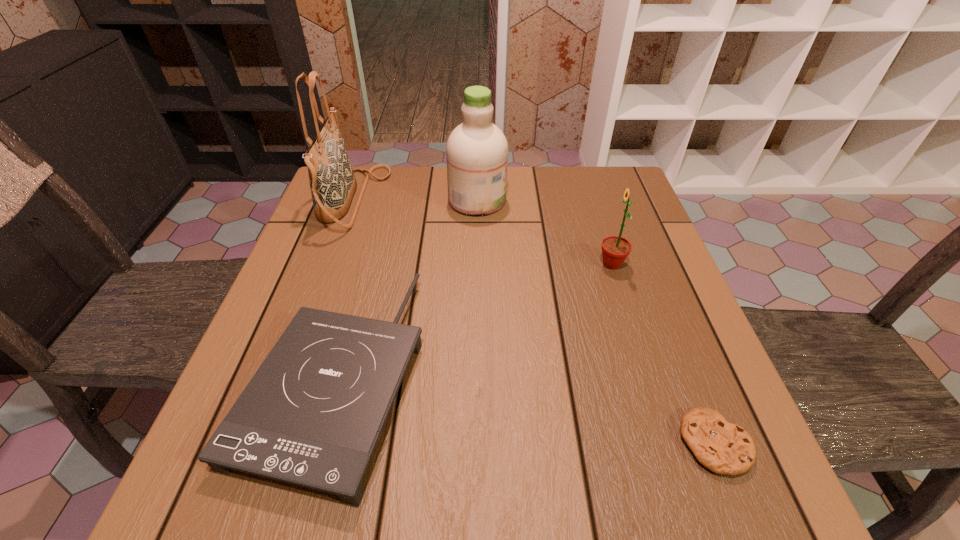
The image size is (960, 540). I want to click on handbag, so click(x=332, y=181).

Locate an element on the screen. the third object from left to right is located at coordinates (477, 150).

At what (x,y) coordinates should I click in order to perform the action: click on the third shortest object. Please return your answer as a coordinate pair (x, y). Image resolution: width=960 pixels, height=540 pixels. Looking at the image, I should click on (615, 249).

The width and height of the screenshot is (960, 540). I want to click on sunflower, so click(x=615, y=249).

Locate an element on the screen. The image size is (960, 540). the second shortest object is located at coordinates (312, 414).

Where is `cookie`? This screenshot has height=540, width=960. cookie is located at coordinates (724, 448).

This screenshot has height=540, width=960. Identify the location of vacant space located 0.380m on the front-facing side of the handbag. (522, 200).

This screenshot has width=960, height=540. In order to click on vacant space located 0.110m on the front label of the third object from left to right in this screenshot , I will do `click(546, 200)`.

Find the location of a particular element. blank space located 0.320m on the face of the sunflower is located at coordinates (460, 264).

Where is `vacant space located on the face of the sunflower`? vacant space located on the face of the sunflower is located at coordinates (512, 264).